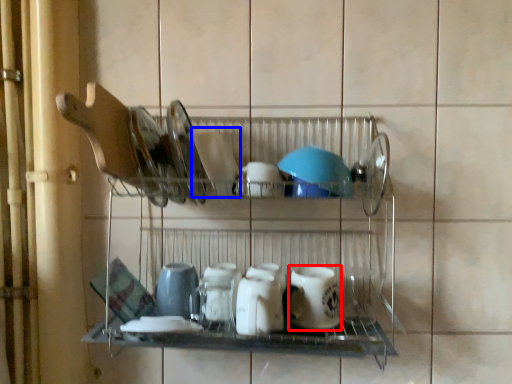
Question: Among these objects, which one is nearest to the camera, tableware (highlighted by a red box) or tableware (highlighted by a blue box)?

Choices:
 (A) tableware
 (B) tableware

Answer: (B)